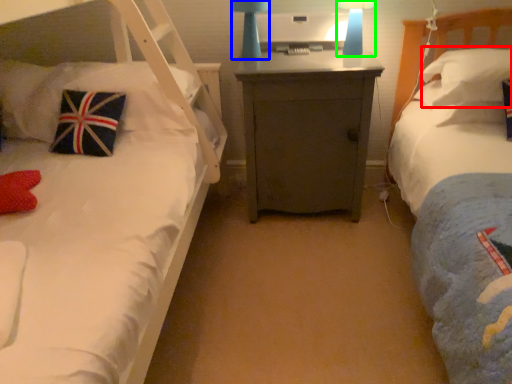
Question: Which object is positioned farthest from pillow (highlighted by a red box)? Select from bedside lamp (highlighted by a blue box) and bedside lamp (highlighted by a green box).

Choices:
 (A) bedside lamp
 (B) bedside lamp

Answer: (A)